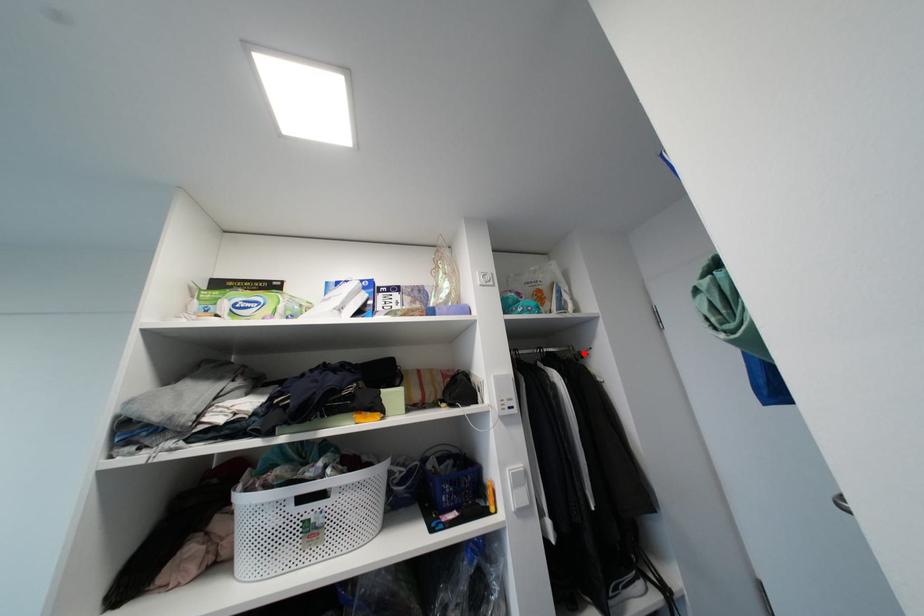
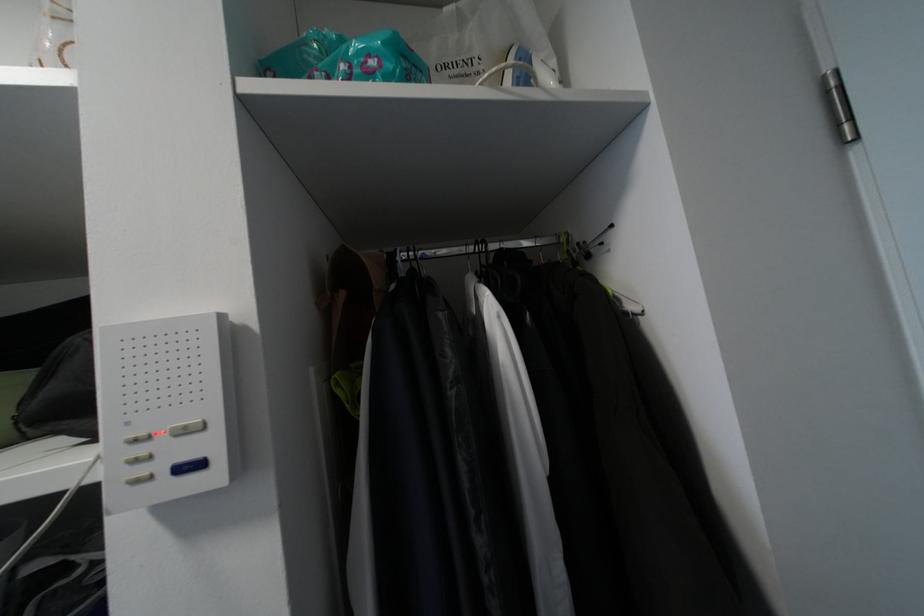
Locate, in the second image, the point that corresponds to the highlighted location in the first image.

(586, 245)